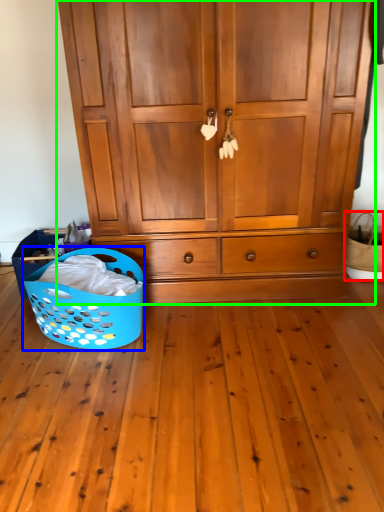
Question: Which is nearer to the basket (highlighted by a red box)? basket (highlighted by a blue box) or cupboard (highlighted by a green box).

Choices:
 (A) basket
 (B) cupboard

Answer: (B)